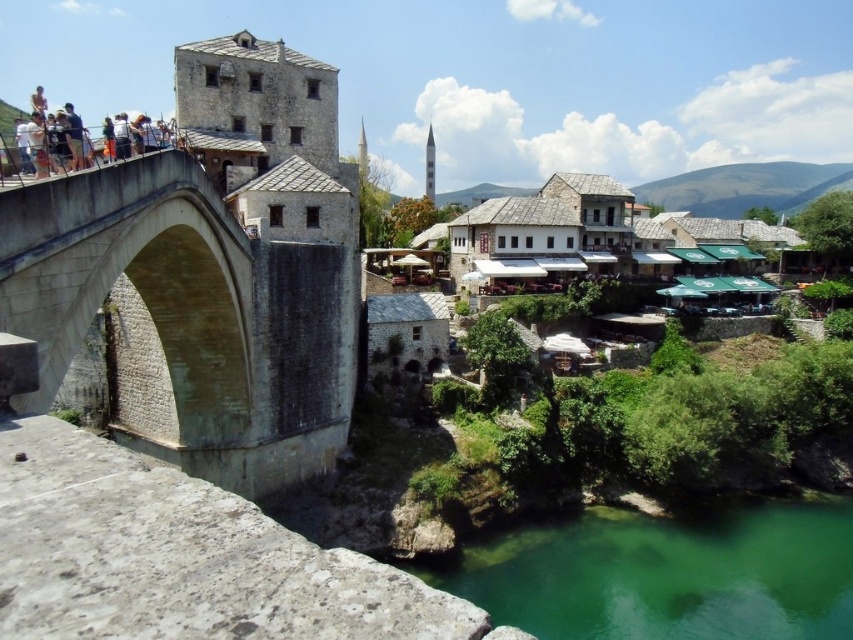
Who is positioned more to the left, white stone minaret at upper center or white stone tower at center?

white stone tower at center

Is white stone minaret at upper center to the left of white stone tower at center from the viewer's perspective?

No, white stone minaret at upper center is not to the left of white stone tower at center.

What do you see at coordinates (428, 164) in the screenshot? I see `white stone minaret at upper center` at bounding box center [428, 164].

At what (x,y) coordinates should I click in order to perform the action: click on white stone minaret at upper center. Please return your answer as a coordinate pair (x, y). This screenshot has width=853, height=640. Looking at the image, I should click on (428, 164).

Is point (503, 531) closer to camera compared to point (433, 141)?

Yes, it is.

Can you confirm if green translucent water at lower center is smaller than white stone minaret at upper center?

Yes, green translucent water at lower center is smaller than white stone minaret at upper center.

Is point (581, 536) less distant than point (432, 163)?

Yes, point (581, 536) is in front of point (432, 163).

Locate an element on the screen. Image resolution: width=853 pixels, height=640 pixels. green translucent water at lower center is located at coordinates (666, 573).

Does green translucent water at lower center appear over white stone tower at center?

Incorrect, green translucent water at lower center is not positioned above white stone tower at center.

Who is positioned more to the left, green translucent water at lower center or white stone tower at center?

white stone tower at center is more to the left.

The width and height of the screenshot is (853, 640). What do you see at coordinates (666, 573) in the screenshot?
I see `green translucent water at lower center` at bounding box center [666, 573].

The height and width of the screenshot is (640, 853). Find the location of `green translucent water at lower center`. green translucent water at lower center is located at coordinates (666, 573).